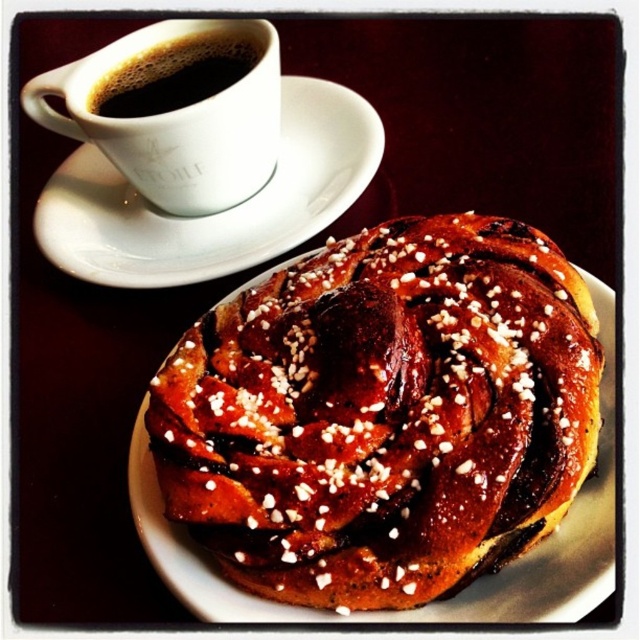
Is point (264, 132) more distant than point (220, 42)?

No, (264, 132) is closer to viewer.

Which of these two, black matte cup at upper left or black glossy cup at upper left, stands taller?

black matte cup at upper left

Find the location of `black matte cup at upper left`. black matte cup at upper left is located at coordinates (176, 122).

Which is more to the left, golden-brown glazed pastry at center or black glossy cup at upper left?

black glossy cup at upper left

Between golden-brown glazed pastry at center and black glossy cup at upper left, which one has less height?

black glossy cup at upper left is shorter.

Is point (470, 307) farther from camera compared to point (227, 29)?

No, it is not.

Identify the location of golden-brown glazed pastry at center. pos(384,413).

Is golden-brown glazed pastry at center positioned behind black matte cup at upper left?

No, it is not.

Is golden-brown glazed pastry at center positioned in front of black matte cup at upper left?

Yes, it is in front of black matte cup at upper left.

Does point (202, 456) lie in front of point (196, 205)?

Yes, it is.

Where is `golden-brown glazed pastry at center`? golden-brown glazed pastry at center is located at coordinates (384, 413).